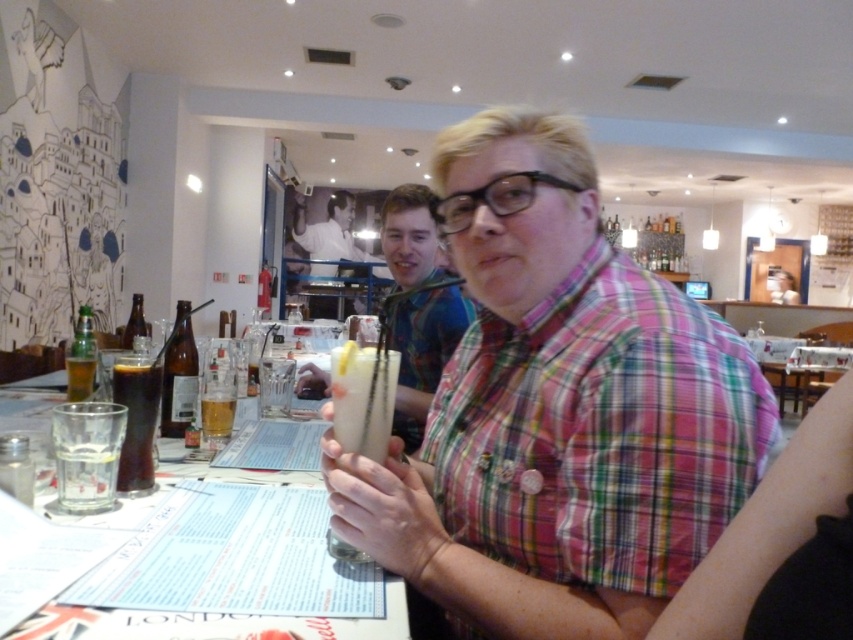
Question: Considering the relative positions of translucent glass at table center and brown glass bottle at center in the image provided, where is translucent glass at table center located with respect to brown glass bottle at center?

Choices:
 (A) left
 (B) right

Answer: (B)

Question: Which point is closer to the camera?

Choices:
 (A) (86, 364)
 (B) (91, 451)

Answer: (B)

Question: Among these points, which one is farthest from the camera?

Choices:
 (A) (163, 424)
 (B) (207, 397)
 (C) (554, 205)

Answer: (A)

Question: Where is clear glass at center located in relation to clear glass at lower left in the image?

Choices:
 (A) above
 (B) below

Answer: (B)

Question: Among these points, which one is farthest from the camera?

Choices:
 (A) (450, 513)
 (B) (91, 364)
 (C) (135, 323)

Answer: (C)

Question: Is translucent glass bottle at center wider than green glass bottle at left?

Choices:
 (A) yes
 (B) no

Answer: (B)